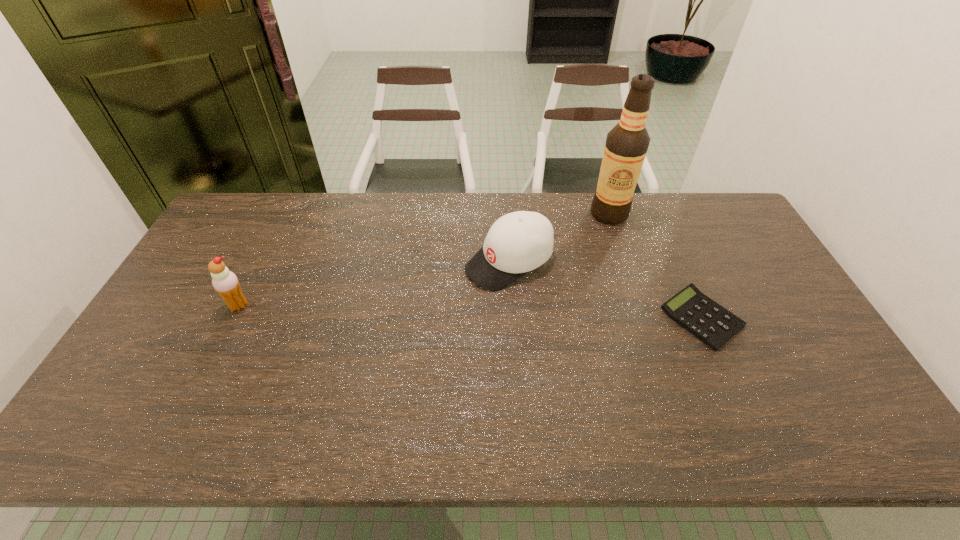
The image size is (960, 540). What are the coordinates of `vacant space on the desktop that is between the leftmost object and the calculator and is positioned on the front-facing side of the third object from right to left` in the screenshot? It's located at (420, 310).

Identify the location of vacant space on the desktop that is between the icecream and the shortest object and is positioned on the label of the tallest object. The image size is (960, 540). (526, 313).